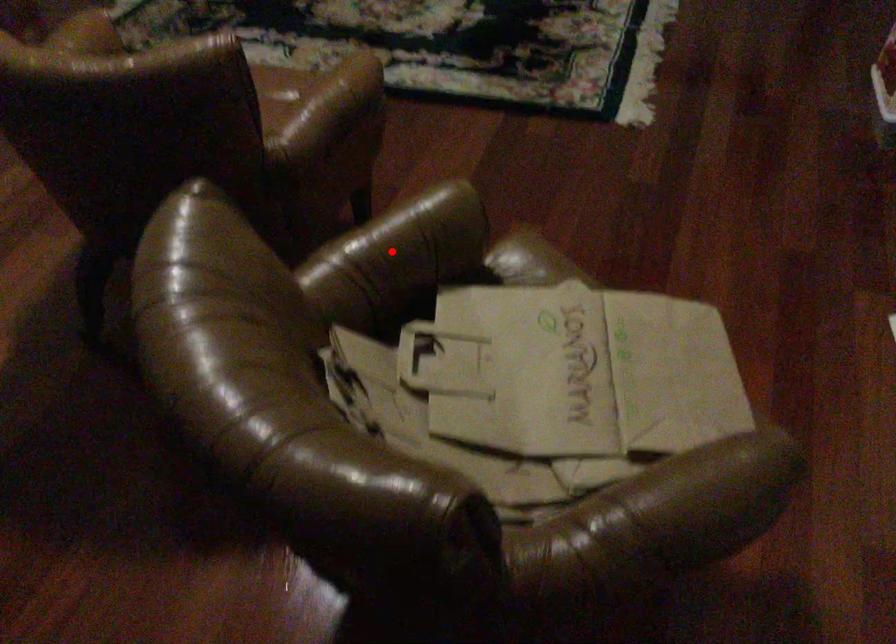
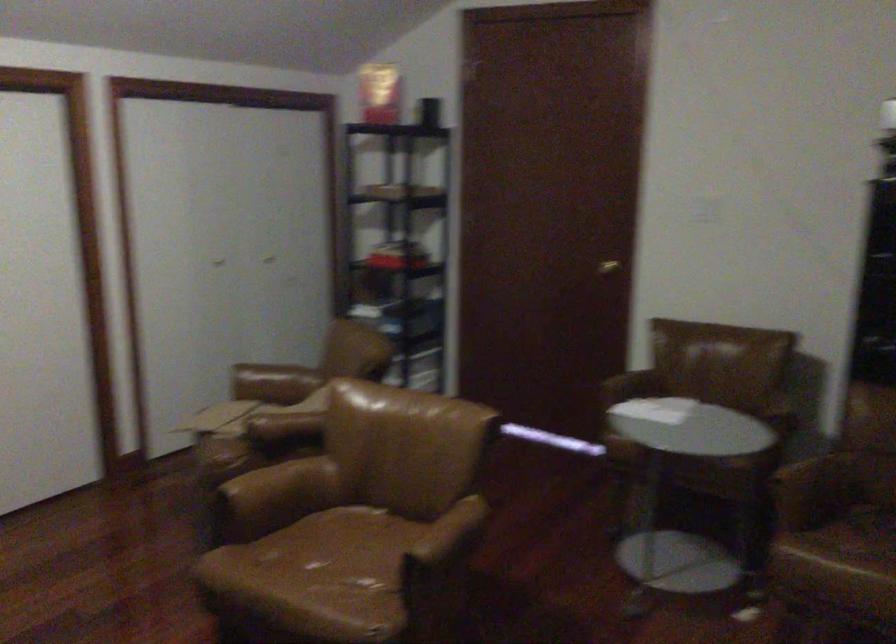
Question: I am providing you with two images of the same scene from different viewpoints. Image1 has a red point marked. In image2, the corresponding 3D location appears at what relative position? Reply with the corresponding letter.

Choices:
 (A) Closer
 (B) Farther

Answer: (B)